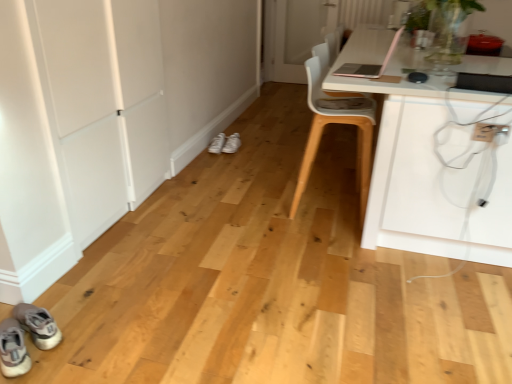
Question: From a real-world perspective, is white matte door at left, arranged as the 2th door when viewed from the top, above or below pink matte laptop at upper right?

Choices:
 (A) above
 (B) below

Answer: (B)

Question: Looking at the image, does white matte door at left, which appears as the 2th door when viewed from the right, seem bigger or smaller compared to pink matte laptop at upper right?

Choices:
 (A) small
 (B) big

Answer: (B)

Question: Which of these objects is positioned closest to the pink matte laptop at upper right?

Choices:
 (A) white glass door at center, which is the 2th door in left-to-right order
 (B) white fabric sneakers at center, the 1th footwear viewed from the right
 (C) white plastic electric outlet at lower right
 (D) light gray fabric sneakers at lower left, the first footwear viewed from the front
 (E) white plastic chair at upper right

Answer: (E)

Question: Which object is the closest to the pink matte laptop at upper right?

Choices:
 (A) white fabric sneakers at center, placed as the first footwear when sorted from top to bottom
 (B) white plastic chair at upper right
 (C) white matte door at left, the first door from the bottom
 (D) white leather sneakers at center, which is the 2th footwear from back to front
 (E) white glass door at center, which is the 2th door in left-to-right order

Answer: (B)